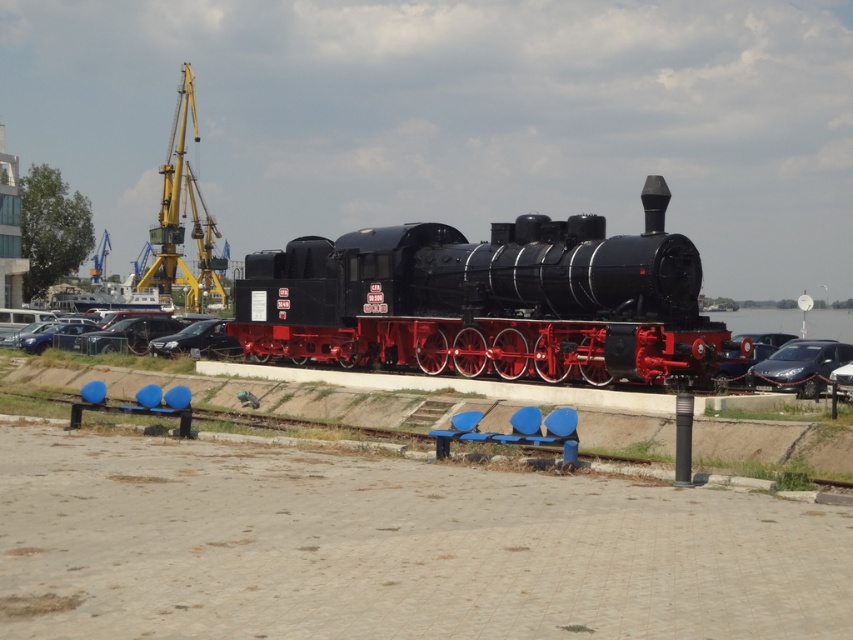
Question: Which object is the closest to the transparent glass water at center?

Choices:
 (A) shiny black sedan at center
 (B) shiny silver sedan at right
 (C) yellow metallic crane at left

Answer: (A)

Question: Among these objects, which one is farthest from the camera?

Choices:
 (A) shiny black sedan at center
 (B) polished black locomotive at center
 (C) shiny silver sedan at right

Answer: (A)

Question: Which object is farther from the camera taking this photo?

Choices:
 (A) shiny silver sedan at right
 (B) transparent glass water at center
 (C) black glossy car at center
 (D) shiny black sedan at left

Answer: (D)

Question: Observing the image, what is the correct spatial positioning of transparent glass water at center in reference to black glossy car at center?

Choices:
 (A) below
 (B) above

Answer: (B)

Question: Is polished black locomotive at center thinner than shiny black sedan at center?

Choices:
 (A) yes
 (B) no

Answer: (A)

Question: Does polished black locomotive at center lie in front of black glossy car at center?

Choices:
 (A) no
 (B) yes

Answer: (B)